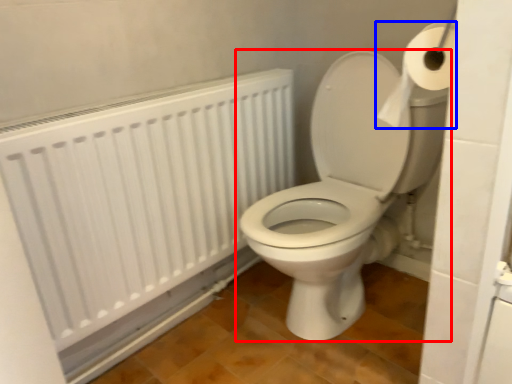
Question: Which object appears farthest to the camera in this image, toilet (highlighted by a red box) or toilet paper (highlighted by a blue box)?

Choices:
 (A) toilet
 (B) toilet paper

Answer: (A)